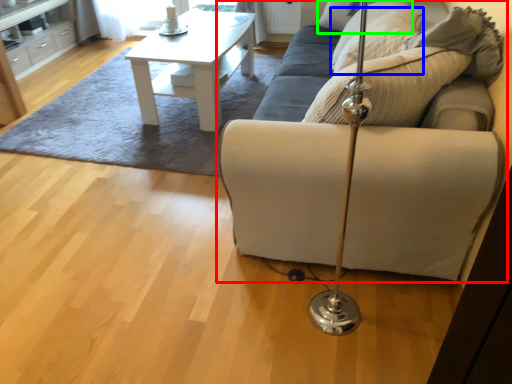
Question: Which is nearer to the studio couch (highlighted by a red box)? pillow (highlighted by a blue box) or pillow (highlighted by a green box).

Choices:
 (A) pillow
 (B) pillow

Answer: (A)